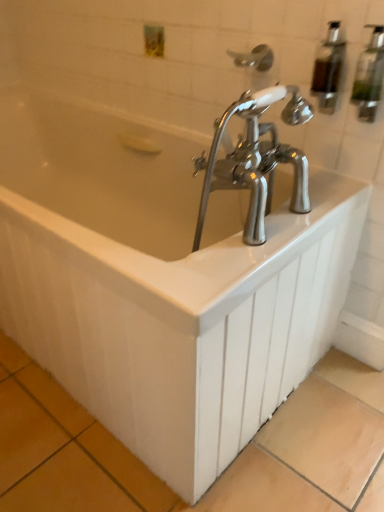
Question: Are clear plastic shower head at upper center and translucent plastic soap dispenser at upper right, which is the second soap dispenser in right-to-left order, located far from each other?

Choices:
 (A) no
 (B) yes

Answer: (A)

Question: Could translucent plastic soap dispenser at upper right, which is the second soap dispenser in right-to-left order, be considered to be inside clear plastic shower head at upper center?

Choices:
 (A) no
 (B) yes

Answer: (A)

Question: Does clear plastic shower head at upper center lie in front of translucent plastic soap dispenser at upper right, the first soap dispenser in the left-to-right sequence?

Choices:
 (A) yes
 (B) no

Answer: (B)

Question: From a real-world perspective, is clear plastic shower head at upper center under translucent plastic soap dispenser at upper right, which is the second soap dispenser in right-to-left order?

Choices:
 (A) yes
 (B) no

Answer: (A)

Question: Does clear plastic shower head at upper center have a greater width compared to translucent plastic soap dispenser at upper right, which is the second soap dispenser in right-to-left order?

Choices:
 (A) no
 (B) yes

Answer: (B)

Question: Considering the positions of clear glass soap dispenser at upper right, the first soap dispenser from the right, and translucent plastic soap dispenser at upper right, the first soap dispenser in the left-to-right sequence, in the image, is clear glass soap dispenser at upper right, the first soap dispenser from the right, bigger or smaller than translucent plastic soap dispenser at upper right, the first soap dispenser in the left-to-right sequence,?

Choices:
 (A) small
 (B) big

Answer: (B)

Question: From the image's perspective, is clear glass soap dispenser at upper right, placed as the second soap dispenser when sorted from left to right, positioned above or below translucent plastic soap dispenser at upper right, which is the second soap dispenser in right-to-left order?

Choices:
 (A) above
 (B) below

Answer: (B)

Question: From a real-world perspective, relative to translucent plastic soap dispenser at upper right, the first soap dispenser in the left-to-right sequence, is clear glass soap dispenser at upper right, the first soap dispenser from the right, vertically above or below?

Choices:
 (A) below
 (B) above

Answer: (B)

Question: Relative to translucent plastic soap dispenser at upper right, the first soap dispenser in the left-to-right sequence, is clear glass soap dispenser at upper right, placed as the second soap dispenser when sorted from left to right, in front or behind?

Choices:
 (A) front
 (B) behind

Answer: (A)

Question: Considering the positions of clear glass soap dispenser at upper right, the first soap dispenser from the right, and clear plastic shower head at upper center in the image, is clear glass soap dispenser at upper right, the first soap dispenser from the right, wider or thinner than clear plastic shower head at upper center?

Choices:
 (A) thin
 (B) wide

Answer: (A)

Question: Would you say clear glass soap dispenser at upper right, the first soap dispenser from the right, is inside or outside clear plastic shower head at upper center?

Choices:
 (A) outside
 (B) inside

Answer: (A)

Question: In the image, is clear glass soap dispenser at upper right, the first soap dispenser from the right, on the left side or the right side of clear plastic shower head at upper center?

Choices:
 (A) right
 (B) left

Answer: (A)

Question: Based on their sizes in the image, would you say clear glass soap dispenser at upper right, placed as the second soap dispenser when sorted from left to right, is bigger or smaller than clear plastic shower head at upper center?

Choices:
 (A) big
 (B) small

Answer: (B)

Question: From a real-world perspective, is translucent plastic soap dispenser at upper right, which is the second soap dispenser in right-to-left order, above or below clear glass soap dispenser at upper right, placed as the second soap dispenser when sorted from left to right?

Choices:
 (A) below
 (B) above

Answer: (A)

Question: Is point (322, 45) positioned closer to the camera than point (354, 96)?

Choices:
 (A) closer
 (B) farther

Answer: (B)